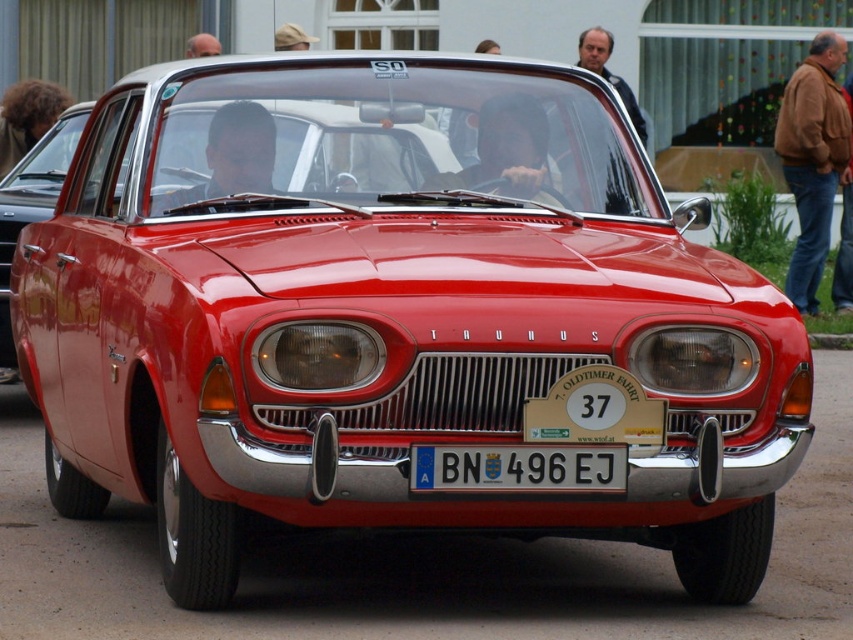
Is black plastic license plate at center bigger than shiny red car at center?

No.

Does point (550, 474) lie behind point (27, 205)?

No.

Find the location of a particular element. black plastic license plate at center is located at coordinates (518, 468).